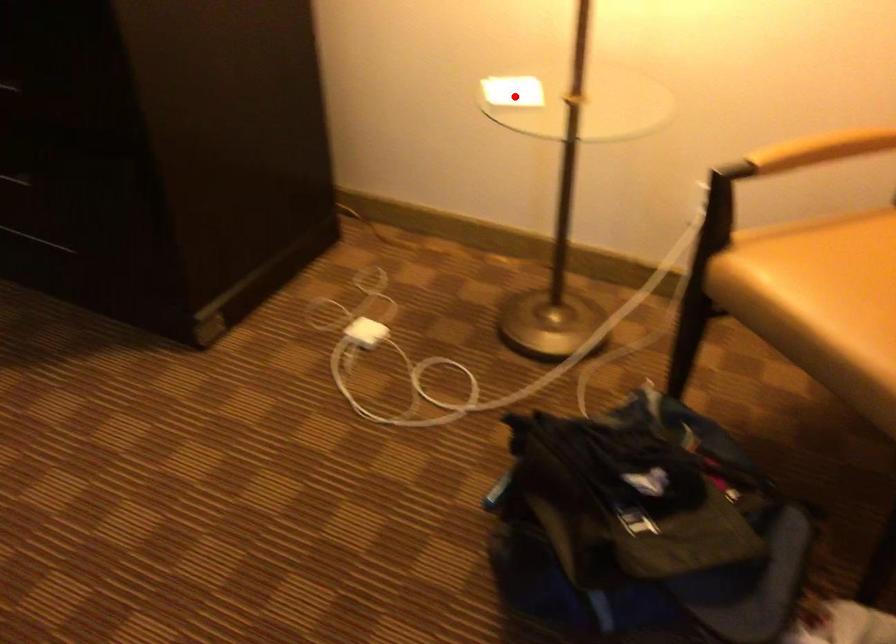
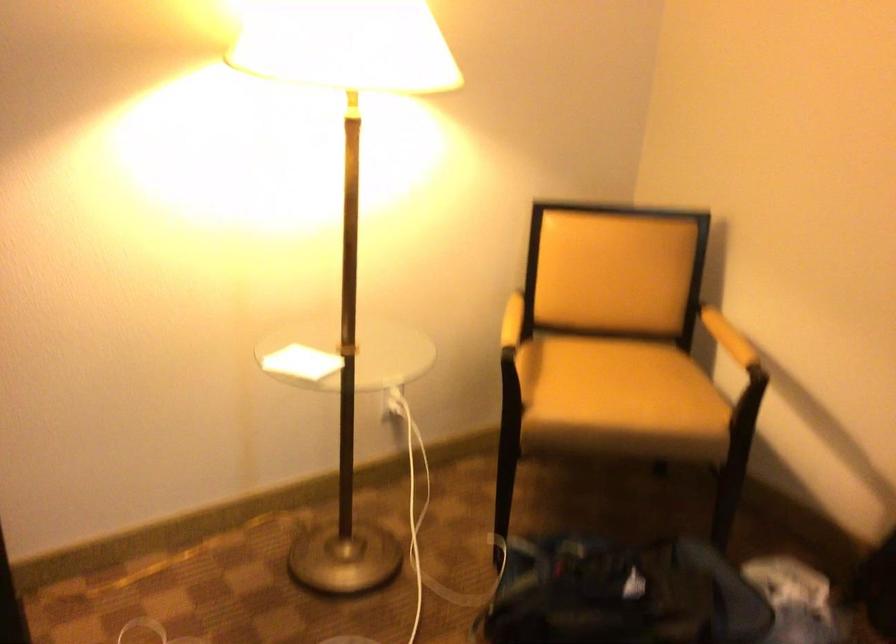
Find the pixel in the second image that matches the highlighted location in the first image.

(300, 363)